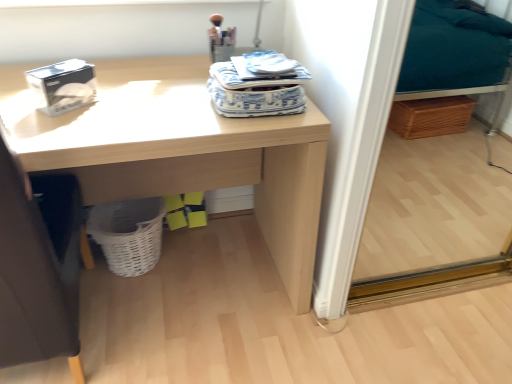
Question: From the image's perspective, is light wood desk at center under white woven basket at lower left?

Choices:
 (A) no
 (B) yes

Answer: (A)

Question: Can you confirm if light wood desk at center is wider than white woven basket at lower left?

Choices:
 (A) no
 (B) yes

Answer: (B)

Question: Would you say light wood desk at center is a long distance from white woven basket at lower left?

Choices:
 (A) yes
 (B) no

Answer: (B)

Question: From the image's perspective, is light wood desk at center on top of white woven basket at lower left?

Choices:
 (A) yes
 (B) no

Answer: (A)

Question: Is white woven basket at lower left surrounded by light wood desk at center?

Choices:
 (A) no
 (B) yes

Answer: (B)

Question: Is light wood desk at center aimed at white woven basket at lower left?

Choices:
 (A) no
 (B) yes

Answer: (A)

Question: Considering the relative sizes of white woven basket at lower left and dark gray fabric swivel chair at left in the image provided, is white woven basket at lower left taller than dark gray fabric swivel chair at left?

Choices:
 (A) yes
 (B) no

Answer: (B)

Question: Is dark gray fabric swivel chair at left a part of white woven basket at lower left?

Choices:
 (A) yes
 (B) no

Answer: (B)

Question: From the image's perspective, is white woven basket at lower left on dark gray fabric swivel chair at left?

Choices:
 (A) no
 (B) yes

Answer: (A)

Question: Can you confirm if white woven basket at lower left is wider than dark gray fabric swivel chair at left?

Choices:
 (A) yes
 (B) no

Answer: (B)

Question: Is white woven basket at lower left thinner than dark gray fabric swivel chair at left?

Choices:
 (A) yes
 (B) no

Answer: (A)

Question: Considering the relative sizes of white woven basket at lower left and dark gray fabric swivel chair at left in the image provided, is white woven basket at lower left shorter than dark gray fabric swivel chair at left?

Choices:
 (A) no
 (B) yes

Answer: (B)

Question: Is yellow matte box at lower center, the second box when ordered from left to right, aimed at white matte tissue box at upper left, marked as the 2th box in a bottom-to-top arrangement?

Choices:
 (A) yes
 (B) no

Answer: (B)